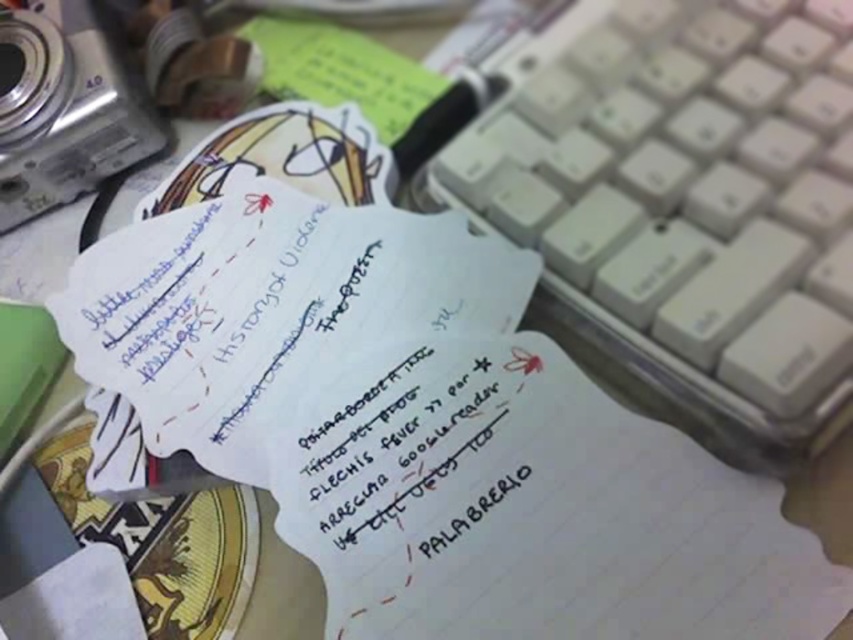
You are organizing the desk and need to place a new item between the white paper at center and the green paper at upper center. Based on their positions, where should you place the new item?

The white paper at center is below the green paper at upper center, so you should place the new item between them by positioning it above the white paper at center but below the green paper at upper center.

Consider the image. You are organizing items on a desk and need to place a new object. There are two points marked on the desk at coordinates point (468,528) and point (393,113). Which point is closer to the camera located to the left of the notes?

Point (468,528) is closer to the camera located to the left of the notes than point (393,113).

You are organizing items on a desk and need to place a new object between the two points labeled point [840,365] and point [387,513]. Based on their positions, which point should the new object be closer to?

The new object should be closer to point [387,513] because point [840,365] is in front of it, meaning it is closer to the viewer. Placing the object between them would require it to be nearer to the point that is further away to maintain spatial order.